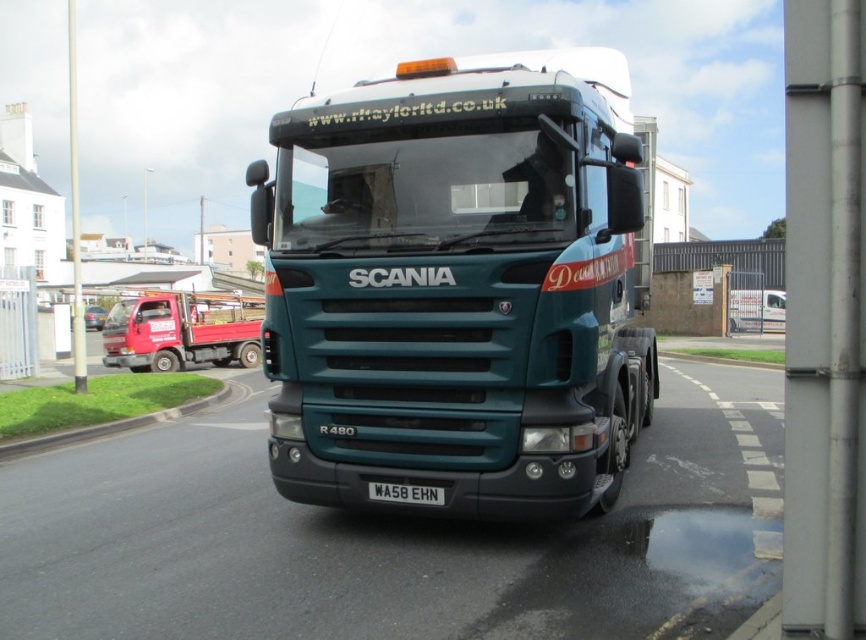
You are a delivery driver who needs to park your truck in a way that the matte red truck at left and the black metal license plate at center are both visible in your rearview mirror. Based on their positions, which object should appear higher in your mirror?

The matte red truck at left is located above the black metal license plate at center, so in the rearview mirror, the matte red truck at left would appear higher than the black metal license plate at center.

You are standing in front of the Scania R480 truck and want to locate two specific points marked on the truck. The first point is at coordinates point (172, 301), and the second is at point (399, 492). Which of these points is closer to the camera?

Point (399, 492) is closer to the camera because it is in front of point (172, 301), which is behind it.